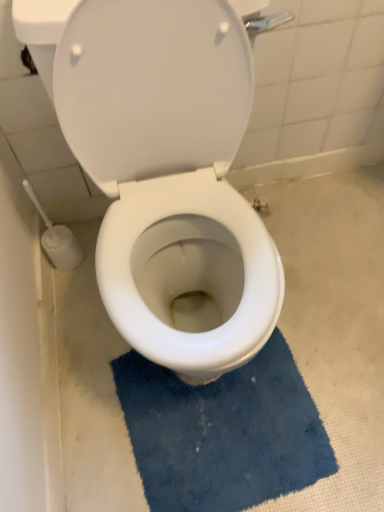
The width and height of the screenshot is (384, 512). Describe the element at coordinates (57, 239) in the screenshot. I see `white plastic toilet brush at lower left` at that location.

Image resolution: width=384 pixels, height=512 pixels. I want to click on blue textured bath mat at lower center, so click(223, 432).

Which object is closer to the camera taking this photo, white glossy toilet at center or blue textured bath mat at lower center?

white glossy toilet at center is in front.

Is white glossy toilet at center turned away from blue textured bath mat at lower center?

No, blue textured bath mat at lower center is not at the back of white glossy toilet at center.

Is white glossy toilet at center taller or shorter than blue textured bath mat at lower center?

Considering their sizes, white glossy toilet at center has more height than blue textured bath mat at lower center.

Between white plastic toilet brush at lower left and blue textured bath mat at lower center, which one has less height?

Standing shorter between the two is blue textured bath mat at lower center.

How much distance is there between white plastic toilet brush at lower left and blue textured bath mat at lower center?

24.64 inches.

Who is bigger, white plastic toilet brush at lower left or blue textured bath mat at lower center?

blue textured bath mat at lower center is bigger.

Is white glossy toilet at center looking in the opposite direction of white plastic toilet brush at lower left?

white glossy toilet at center does not have its back to white plastic toilet brush at lower left.

From a real-world perspective, between white glossy toilet at center and white plastic toilet brush at lower left, who is vertically higher?

From a 3D spatial view, white glossy toilet at center is above.

Is the depth of white glossy toilet at center less than that of white plastic toilet brush at lower left?

Yes, white glossy toilet at center is in front of white plastic toilet brush at lower left.

Which object is thinner, blue textured bath mat at lower center or white plastic toilet brush at lower left?

Thinner between the two is white plastic toilet brush at lower left.

This screenshot has width=384, height=512. Find the location of `brush behind the blue textured bath mat at lower center`. brush behind the blue textured bath mat at lower center is located at coordinates (57, 239).

Can white plastic toilet brush at lower left be found inside blue textured bath mat at lower center?

That's incorrect, white plastic toilet brush at lower left is not inside blue textured bath mat at lower center.

Is white plastic toilet brush at lower left not near white glossy toilet at center?

white plastic toilet brush at lower left is actually quite close to white glossy toilet at center.

Considering the relative positions of white plastic toilet brush at lower left and white glossy toilet at center in the image provided, is white plastic toilet brush at lower left to the right of white glossy toilet at center from the viewer's perspective?

Incorrect, white plastic toilet brush at lower left is not on the right side of white glossy toilet at center.

From the image's perspective, is white plastic toilet brush at lower left beneath white glossy toilet at center?

Yes.

Is white glossy toilet at center located within white plastic toilet brush at lower left?

That's incorrect, white glossy toilet at center is not inside white plastic toilet brush at lower left.

Considering the sizes of objects blue textured bath mat at lower center and white glossy toilet at center in the image provided, who is wider, blue textured bath mat at lower center or white glossy toilet at center?

white glossy toilet at center is wider.

Would you consider blue textured bath mat at lower center to be distant from white glossy toilet at center?

Actually, blue textured bath mat at lower center and white glossy toilet at center are a little close together.

Is blue textured bath mat at lower center facing away from white glossy toilet at center?

That's not correct — blue textured bath mat at lower center is not looking away from white glossy toilet at center.

From a real-world perspective, which is physically above, blue textured bath mat at lower center or white glossy toilet at center?

In real-world perspective, white glossy toilet at center is above.

Where is `bath mat below the white glossy toilet at center (from a real-world perspective)`? bath mat below the white glossy toilet at center (from a real-world perspective) is located at coordinates (223, 432).

I want to click on brush on the left side of blue textured bath mat at lower center, so click(57, 239).

Looking at the image, which one is located further to white plastic toilet brush at lower left, white glossy toilet at center or blue textured bath mat at lower center?

blue textured bath mat at lower center is positioned further to the anchor white plastic toilet brush at lower left.

Which object lies further to the anchor point blue textured bath mat at lower center, white glossy toilet at center or white plastic toilet brush at lower left?

The object further to blue textured bath mat at lower center is white plastic toilet brush at lower left.

From the image, which object appears to be farther from white glossy toilet at center, white plastic toilet brush at lower left or blue textured bath mat at lower center?

The object further to white glossy toilet at center is white plastic toilet brush at lower left.

From the image, which object appears to be nearer to blue textured bath mat at lower center, white plastic toilet brush at lower left or white glossy toilet at center?

Among the two, white glossy toilet at center is located nearer to blue textured bath mat at lower center.

Estimate the real-world distances between objects in this image. Which object is further from white plastic toilet brush at lower left, blue textured bath mat at lower center or white glossy toilet at center?

blue textured bath mat at lower center.

From the image, which object appears to be nearer to white glossy toilet at center, blue textured bath mat at lower center or white plastic toilet brush at lower left?

Based on the image, blue textured bath mat at lower center appears to be nearer to white glossy toilet at center.

At what (x,y) coordinates should I click in order to perform the action: click on bath mat positioned between white glossy toilet at center and white plastic toilet brush at lower left from near to far. Please return your answer as a coordinate pair (x, y). This screenshot has width=384, height=512. Looking at the image, I should click on (223, 432).